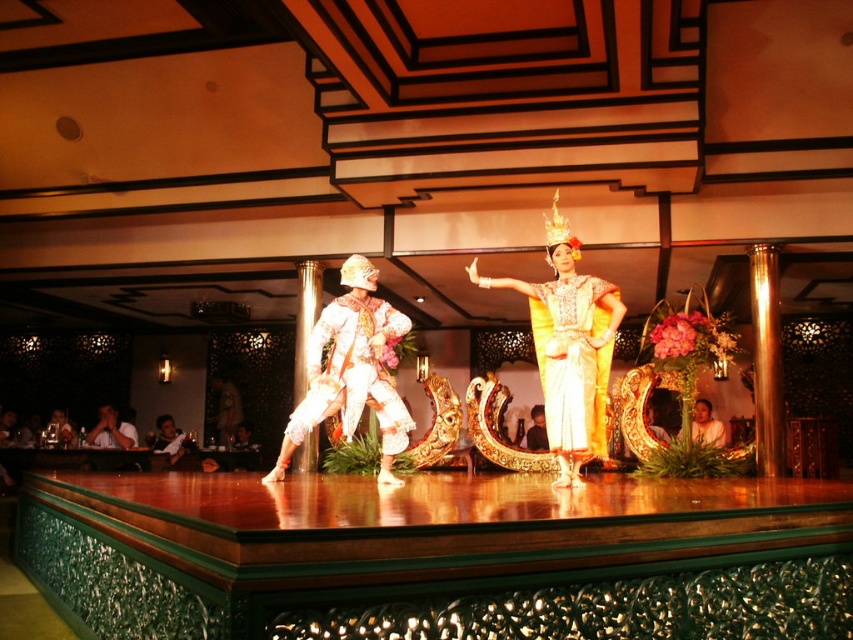
Question: Which point is farther from the camera taking this photo?

Choices:
 (A) (556, 216)
 (B) (583, 305)
 (C) (376, 340)

Answer: (A)

Question: Is gold silk dress at center behind golden silk skirt at center?

Choices:
 (A) no
 (B) yes

Answer: (A)

Question: Which of the following is the farthest from the observer?

Choices:
 (A) golden silk dress at center
 (B) white textured fabric at center

Answer: (B)

Question: In this image, where is white textured fabric at center located relative to golden silk skirt at center?

Choices:
 (A) above
 (B) below

Answer: (A)

Question: Among these points, which one is farthest from the camera?

Choices:
 (A) (296, 442)
 (B) (715, 422)
 (C) (547, 353)

Answer: (B)

Question: Is gold silk dress at center bigger than golden silk skirt at center?

Choices:
 (A) yes
 (B) no

Answer: (B)